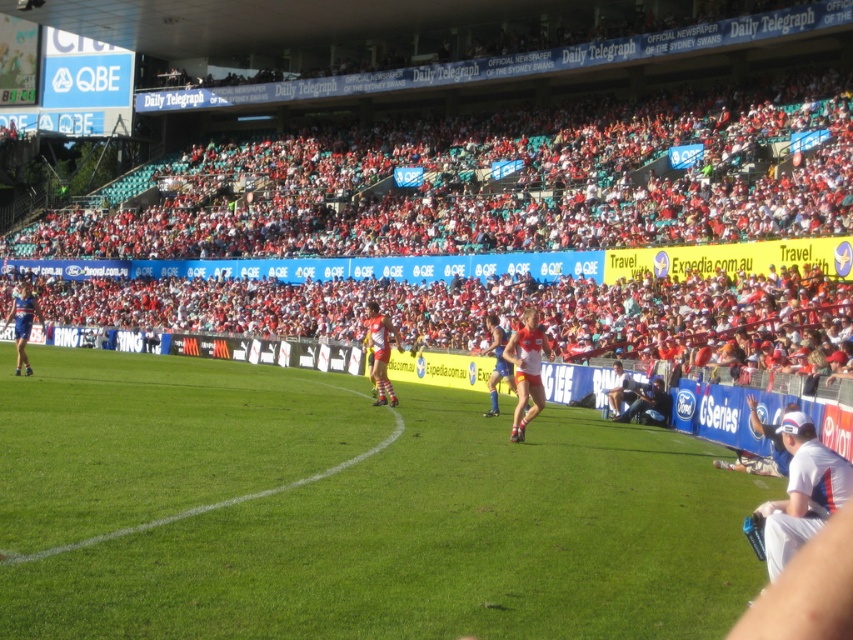
You are a drone operator assigned to capture aerial footage of the Australian Rules Football match at the Sydney Cricket Ground. Your task is to position the camera to focus on the green grass at center. According to the coordinates provided, what are the exact coordinates where you should direct the camera?

The exact coordinates to direct the camera are at point (x=347, y=512), as this is where the green grass at center is located.

You are a spectator at the Sydney Cricket Ground watching the Australian Rules Football match. You see a red jersey at center and a blue jersey at left. Which player is positioned closer to the right side of the field?

The red jersey at center is positioned to the right of the blue jersey at left, so the red jersey at center is closer to the right side of the field.

Based on the photo, you are a photographer at the Sydney Cricket Ground and want to capture a photo that includes both the red jersey at center and the blue jersey at left. Which jersey should you zoom in on to ensure both are clearly visible in the photo?

To ensure both the red jersey at center and the blue jersey at left are clearly visible, you should zoom in on the blue jersey at left since it is larger than the red jersey at center, allowing for better visibility while framing both.